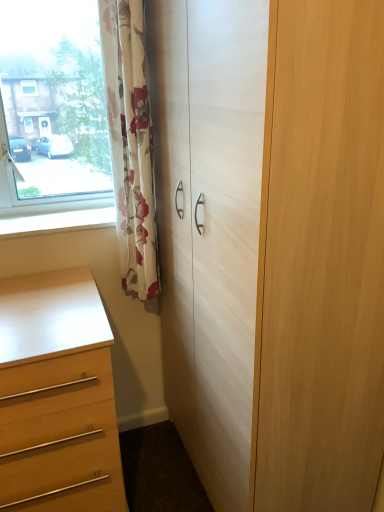
Question: Is white wood cupboard at center turned away from floral fabric curtain at left?

Choices:
 (A) yes
 (B) no

Answer: (B)

Question: Is white wood cupboard at center not within floral fabric curtain at left?

Choices:
 (A) no
 (B) yes

Answer: (B)

Question: Considering the relative sizes of white wood cupboard at center and floral fabric curtain at left in the image provided, is white wood cupboard at center shorter than floral fabric curtain at left?

Choices:
 (A) yes
 (B) no

Answer: (B)

Question: Is white wood cupboard at center next to floral fabric curtain at left?

Choices:
 (A) yes
 (B) no

Answer: (B)

Question: Are white wood cupboard at center and floral fabric curtain at left located far from each other?

Choices:
 (A) no
 (B) yes

Answer: (A)

Question: Is point (137, 208) closer or farther from the camera than point (13, 221)?

Choices:
 (A) closer
 (B) farther

Answer: (A)

Question: From a real-world perspective, is floral fabric curtain at left positioned above or below white glossy window sill at lower left?

Choices:
 (A) above
 (B) below

Answer: (A)

Question: Is floral fabric curtain at left in front of or behind white glossy window sill at lower left in the image?

Choices:
 (A) behind
 (B) front

Answer: (B)

Question: Based on their sizes in the image, would you say floral fabric curtain at left is bigger or smaller than white glossy window sill at lower left?

Choices:
 (A) small
 (B) big

Answer: (B)

Question: From the image's perspective, is matte wood chest of drawers at lower left positioned above or below floral fabric curtain at left?

Choices:
 (A) below
 (B) above

Answer: (A)

Question: In the image, is matte wood chest of drawers at lower left positioned in front of or behind floral fabric curtain at left?

Choices:
 (A) front
 (B) behind

Answer: (A)

Question: Is matte wood chest of drawers at lower left spatially inside floral fabric curtain at left, or outside of it?

Choices:
 (A) inside
 (B) outside

Answer: (B)

Question: From their relative heights in the image, would you say matte wood chest of drawers at lower left is taller or shorter than floral fabric curtain at left?

Choices:
 (A) short
 (B) tall

Answer: (A)

Question: In terms of height, does white wood cupboard at center look taller or shorter compared to white glossy window sill at lower left?

Choices:
 (A) tall
 (B) short

Answer: (A)

Question: Relative to white glossy window sill at lower left, is white wood cupboard at center in front or behind?

Choices:
 (A) behind
 (B) front

Answer: (B)